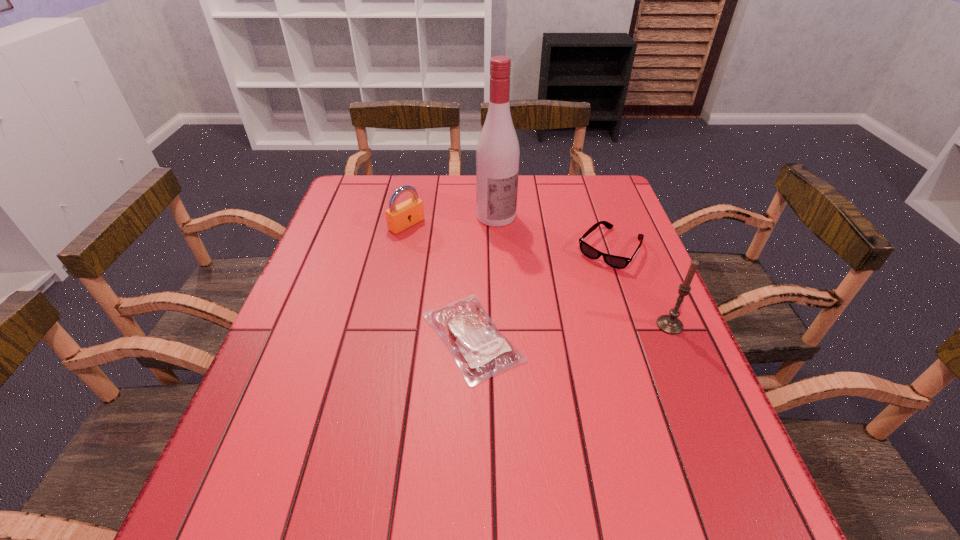
Where is `sunglasses that is at the right edge`? sunglasses that is at the right edge is located at coordinates (619, 262).

The width and height of the screenshot is (960, 540). In order to click on vacant space at the far edge of the desktop in this screenshot , I will do `click(452, 207)`.

In the image, there is a desktop. Where is `vacant space at the near edge`? vacant space at the near edge is located at coordinates (632, 458).

In the image, there is a desktop. Identify the location of free space at the left edge. (361, 278).

Locate an element on the screen. This screenshot has height=540, width=960. free region at the right edge of the desktop is located at coordinates (654, 396).

Where is `free space at the far left corner of the desktop`? The image size is (960, 540). free space at the far left corner of the desktop is located at coordinates (367, 181).

What are the coordinates of `free space between the candle and the leftmost object` in the screenshot? It's located at (539, 275).

You are a GUI agent. You are given a task and a screenshot of the screen. Output one action in this format:
    pyautogui.click(x=<x>, y=<y>)
    Task: Click on the free spot between the candle and the sunglasses
    
    Given the screenshot: What is the action you would take?
    pyautogui.click(x=639, y=287)

I want to click on vacant point located between the second shortest object and the alcohol, so click(x=553, y=233).

Where is `vacant space in between the alcohol and the leftmost object`? vacant space in between the alcohol and the leftmost object is located at coordinates (451, 221).